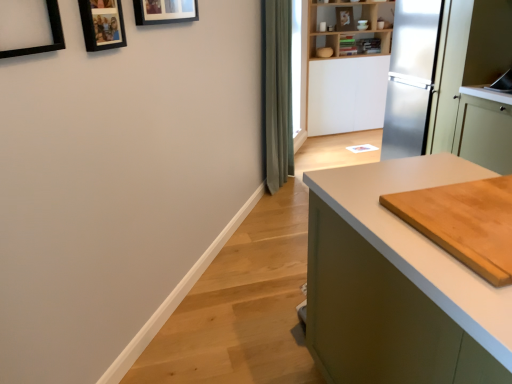
Question: Is light brown wooden cutting board at right at the left side of wooden photo frame at upper left, positioned as the 2th picture frame in front-to-back order?

Choices:
 (A) no
 (B) yes

Answer: (A)

Question: Can you confirm if light brown wooden cutting board at right is bigger than wooden photo frame at upper left, acting as the second picture frame starting from the back?

Choices:
 (A) no
 (B) yes

Answer: (B)

Question: Is light brown wooden cutting board at right outside wooden photo frame at upper left, which appears as the 2th picture frame when viewed from the left?

Choices:
 (A) yes
 (B) no

Answer: (A)

Question: Does light brown wooden cutting board at right appear on the right side of wooden photo frame at upper left, acting as the second picture frame starting from the back?

Choices:
 (A) no
 (B) yes

Answer: (B)

Question: Can you confirm if light brown wooden cutting board at right is wider than wooden photo frame at upper left, positioned as the 2th picture frame in right-to-left order?

Choices:
 (A) no
 (B) yes

Answer: (B)

Question: In the image, is wooden cutting board at right on the left side or the right side of wooden bookshelf at upper center?

Choices:
 (A) right
 (B) left

Answer: (A)

Question: From a real-world perspective, is wooden cutting board at right physically located above or below wooden bookshelf at upper center?

Choices:
 (A) above
 (B) below

Answer: (B)

Question: Which is correct: wooden cutting board at right is inside wooden bookshelf at upper center, or outside of it?

Choices:
 (A) outside
 (B) inside

Answer: (A)

Question: Relative to wooden bookshelf at upper center, is wooden cutting board at right in front or behind?

Choices:
 (A) front
 (B) behind

Answer: (A)

Question: Considering the relative positions of black matte picture frame at upper left, the 1th picture frame positioned from the left, and wooden cutting board at right in the image provided, is black matte picture frame at upper left, the 1th picture frame positioned from the left, to the left or to the right of wooden cutting board at right?

Choices:
 (A) right
 (B) left

Answer: (B)

Question: In terms of width, does black matte picture frame at upper left, which is the first picture frame from front to back, look wider or thinner when compared to wooden cutting board at right?

Choices:
 (A) thin
 (B) wide

Answer: (A)

Question: Is black matte picture frame at upper left, the 3th picture frame positioned from the right, taller or shorter than wooden cutting board at right?

Choices:
 (A) short
 (B) tall

Answer: (A)

Question: From the image's perspective, is black matte picture frame at upper left, the 1th picture frame positioned from the left, positioned above or below wooden cutting board at right?

Choices:
 (A) below
 (B) above

Answer: (B)

Question: Is wooden photo frame at upper left, acting as the second picture frame starting from the back, taller or shorter than black matte picture frame at upper left, the 1th picture frame positioned from the left?

Choices:
 (A) short
 (B) tall

Answer: (B)

Question: From the image's perspective, relative to black matte picture frame at upper left, which ranks as the third picture frame in back-to-front order, is wooden photo frame at upper left, positioned as the 2th picture frame in right-to-left order, above or below?

Choices:
 (A) below
 (B) above

Answer: (B)